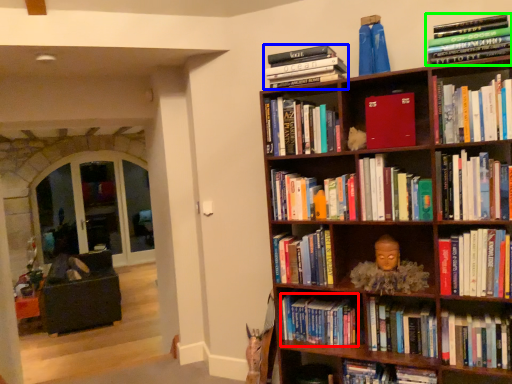
Question: Which object is positioned farthest from book (highlighted by a red box)? Select from book (highlighted by a blue box) and book (highlighted by a green box).

Choices:
 (A) book
 (B) book

Answer: (B)